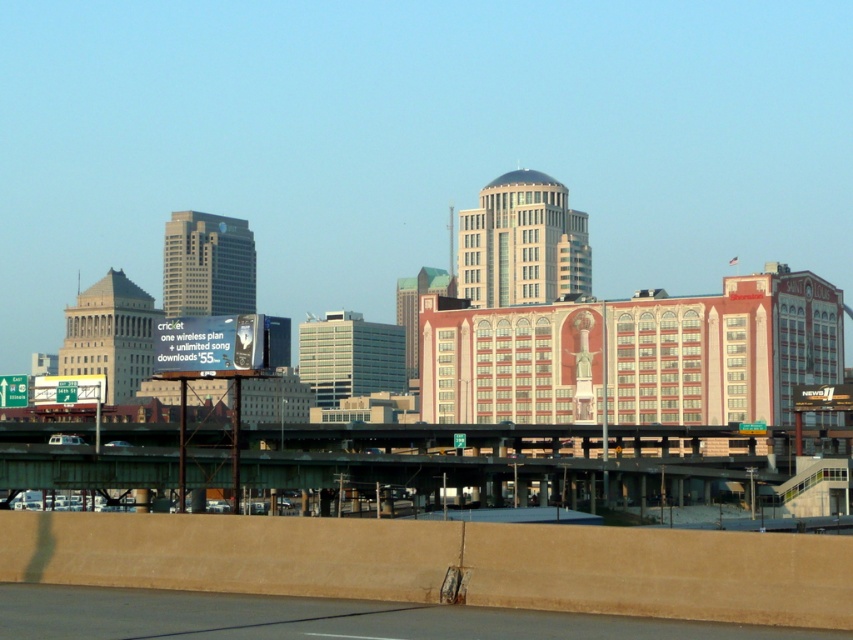
Question: Can you confirm if green metallic bridge at center is wider than concrete pavement at lower center?

Choices:
 (A) yes
 (B) no

Answer: (A)

Question: Which point is closer to the camera?

Choices:
 (A) concrete pavement at lower center
 (B) green metallic bridge at center

Answer: (A)

Question: Which object is farther from the camera taking this photo?

Choices:
 (A) green metallic bridge at center
 (B) concrete pavement at lower center

Answer: (A)

Question: Can you confirm if green metallic bridge at center is positioned above concrete pavement at lower center?

Choices:
 (A) yes
 (B) no

Answer: (B)

Question: Is green metallic bridge at center to the left of concrete pavement at lower center from the viewer's perspective?

Choices:
 (A) yes
 (B) no

Answer: (B)